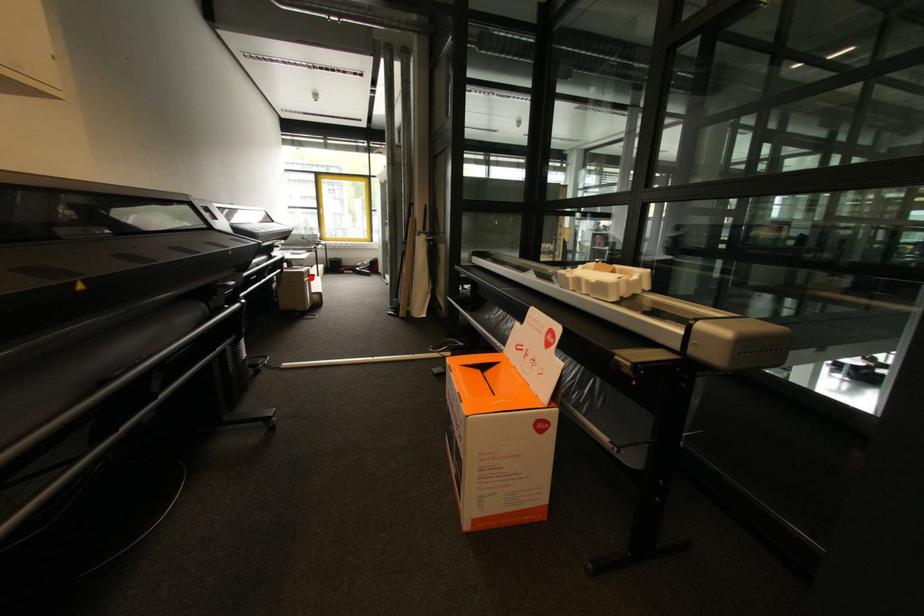
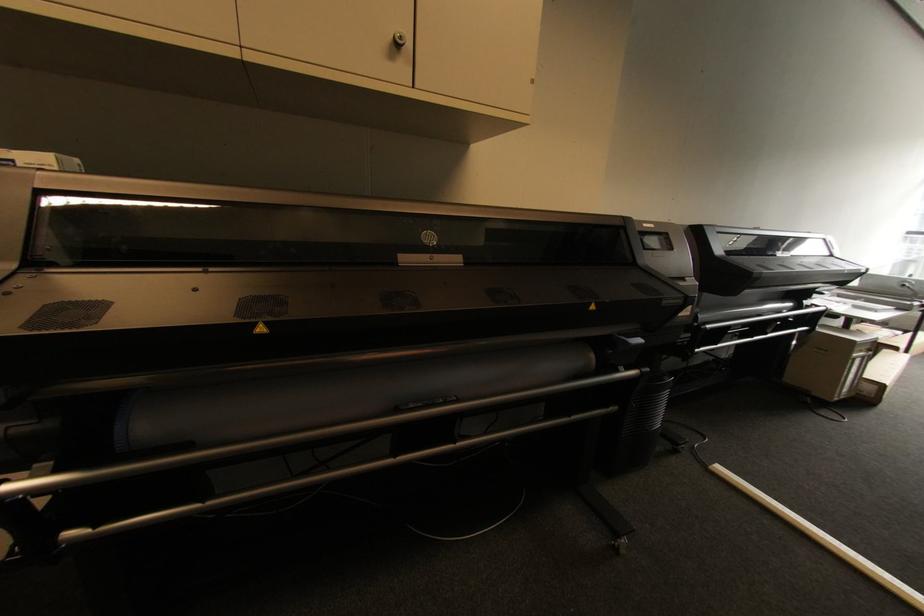
Question: I am providing you with two images of the same scene from different viewpoints. Given a red point in image1, look at the same physical point in image2. Is it:

Choices:
 (A) Closer to the viewpoint
 (B) Farther from the viewpoint

Answer: (A)